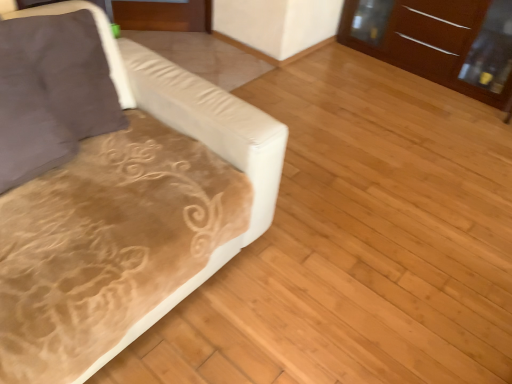
Question: Considering their positions, is velvet beige couch at left located in front of or behind brown glossy dresser at upper right?

Choices:
 (A) front
 (B) behind

Answer: (A)

Question: Is point (11, 170) positioned closer to the camera than point (375, 43)?

Choices:
 (A) closer
 (B) farther

Answer: (A)

Question: Which is farther from the suede-like brown pillow at left?

Choices:
 (A) velvet beige couch at left
 (B) brown glossy dresser at upper right

Answer: (B)

Question: Based on their relative distances, which object is farther from the velvet beige couch at left?

Choices:
 (A) brown glossy dresser at upper right
 (B) suede-like brown pillow at left

Answer: (A)